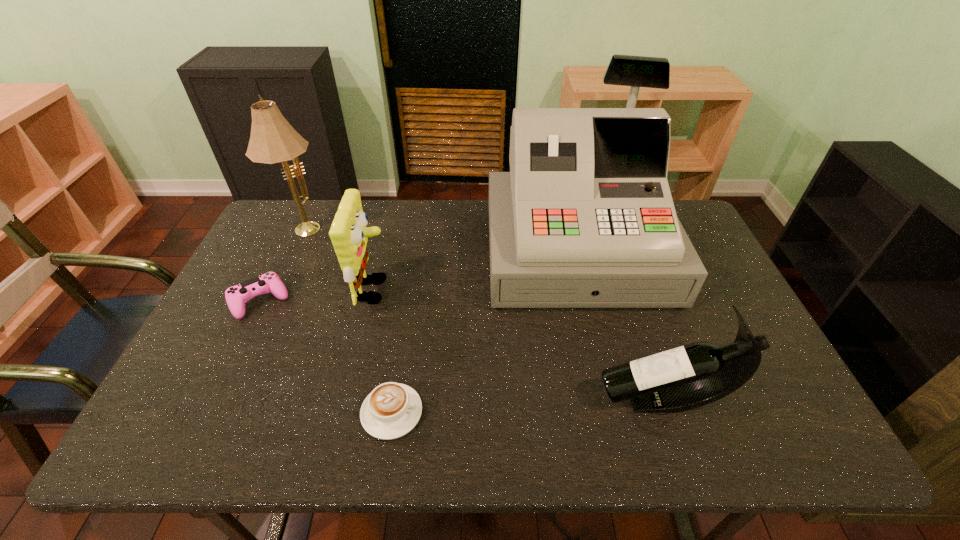
Locate an element on the screen. cash register located in the right edge section of the desktop is located at coordinates (585, 218).

Where is `wine bottle that is at the right edge`? wine bottle that is at the right edge is located at coordinates (690, 376).

At what (x,y) coordinates should I click in order to perform the action: click on object that is at the far left corner. Please return your answer as a coordinate pair (x, y). This screenshot has width=960, height=540. Looking at the image, I should click on (273, 140).

Where is `object at the far right corner`? The image size is (960, 540). object at the far right corner is located at coordinates (585, 218).

Locate an element on the screen. The height and width of the screenshot is (540, 960). object that is at the near right corner is located at coordinates (690, 376).

The width and height of the screenshot is (960, 540). In order to click on free region at the far edge in this screenshot , I will do `click(465, 216)`.

Locate an element on the screen. vacant space at the near edge of the desktop is located at coordinates (733, 443).

Where is `vacant region at the left edge of the desktop`? vacant region at the left edge of the desktop is located at coordinates (289, 270).

Identify the location of free space at the right edge. Image resolution: width=960 pixels, height=540 pixels. click(x=734, y=313).

Where is `free region at the near left corner of the desktop`? free region at the near left corner of the desktop is located at coordinates (155, 452).